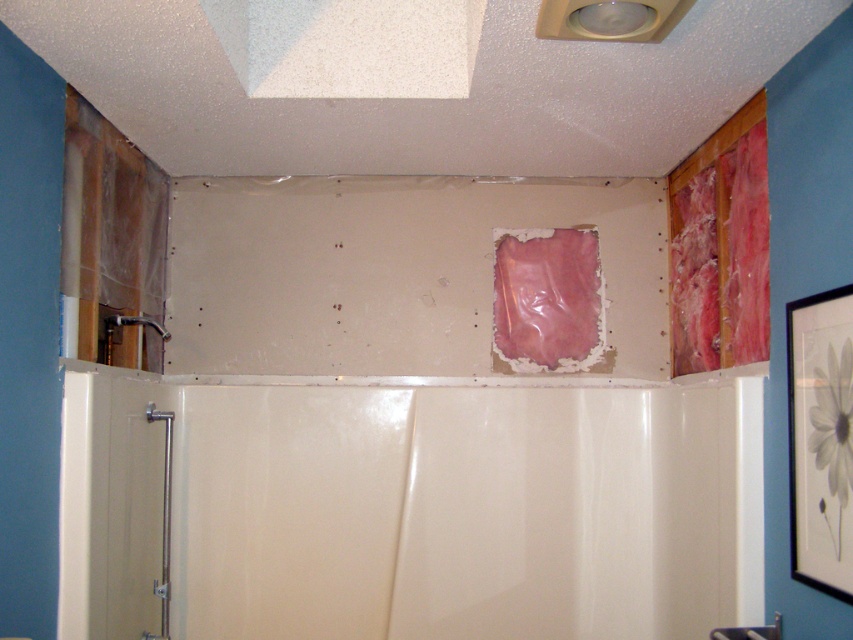
This screenshot has height=640, width=853. Describe the element at coordinates (413, 509) in the screenshot. I see `white glossy bathtub at center` at that location.

Is point (500, 426) behind point (592, 362)?

No, it is not.

Who is more forward, (347,496) or (596,285)?

Point (347,496)

I want to click on white glossy bathtub at center, so click(x=413, y=509).

Where is `pink paper at center`? This screenshot has width=853, height=640. pink paper at center is located at coordinates click(x=547, y=300).

The image size is (853, 640). Describe the element at coordinates (547, 300) in the screenshot. I see `pink paper at center` at that location.

Who is more distant from viewer, [593,332] or [120,317]?

Positioned behind is point [593,332].

This screenshot has width=853, height=640. I want to click on pink paper at center, so click(x=547, y=300).

Is white glossy bathtub at center smaller than matte silver faucet at left?

Actually, white glossy bathtub at center might be larger than matte silver faucet at left.

Who is lower down, white glossy bathtub at center or matte silver faucet at left?

white glossy bathtub at center

Which is in front, point (532, 445) or point (109, 330)?

Point (109, 330) is more forward.

This screenshot has width=853, height=640. In order to click on white glossy bathtub at center in this screenshot , I will do `click(413, 509)`.